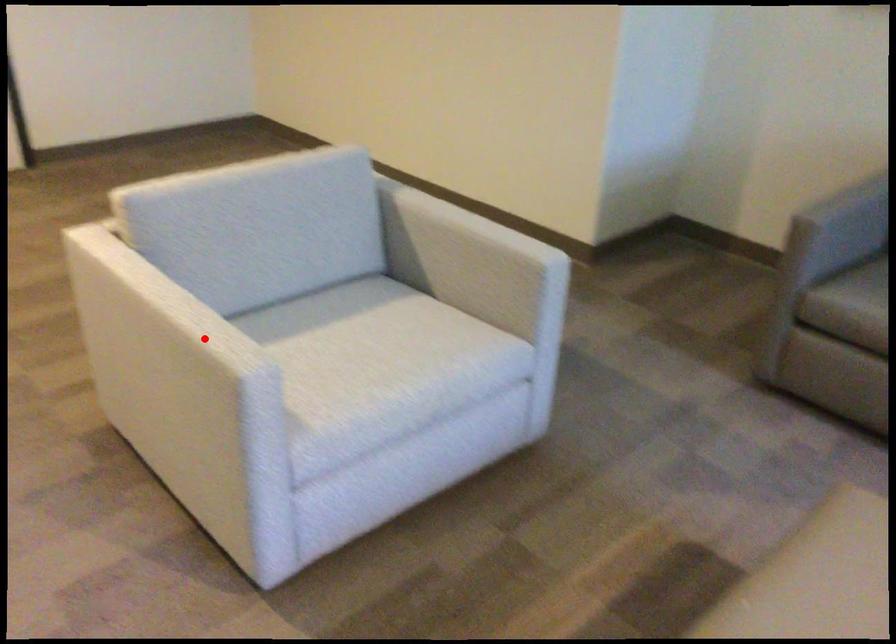
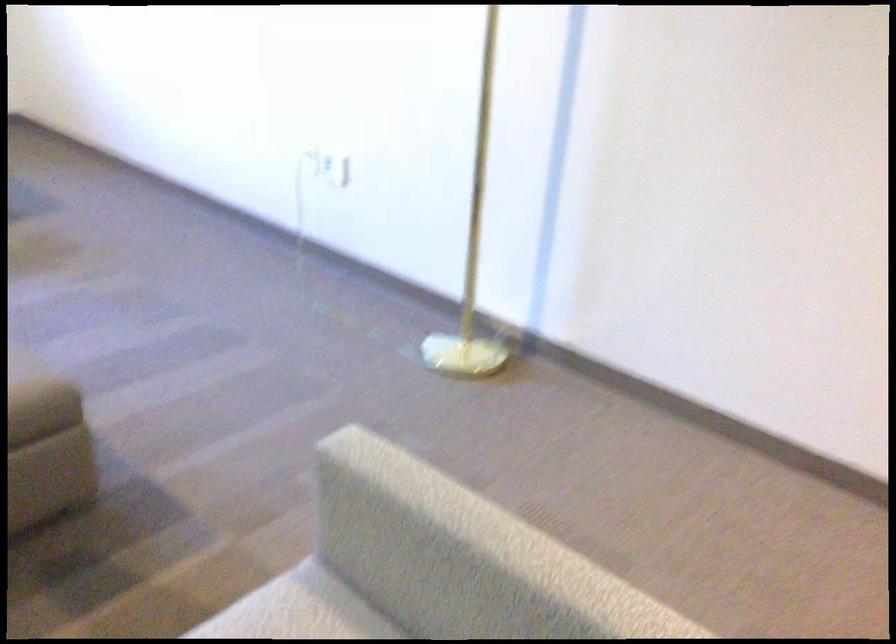
Question: A red point is marked in image1. In image2, is the corresponding 3D point closer to the camera or farther? Reply with the corresponding letter.

Choices:
 (A) The corresponding 3D point is closer.
 (B) The corresponding 3D point is farther.

Answer: (A)